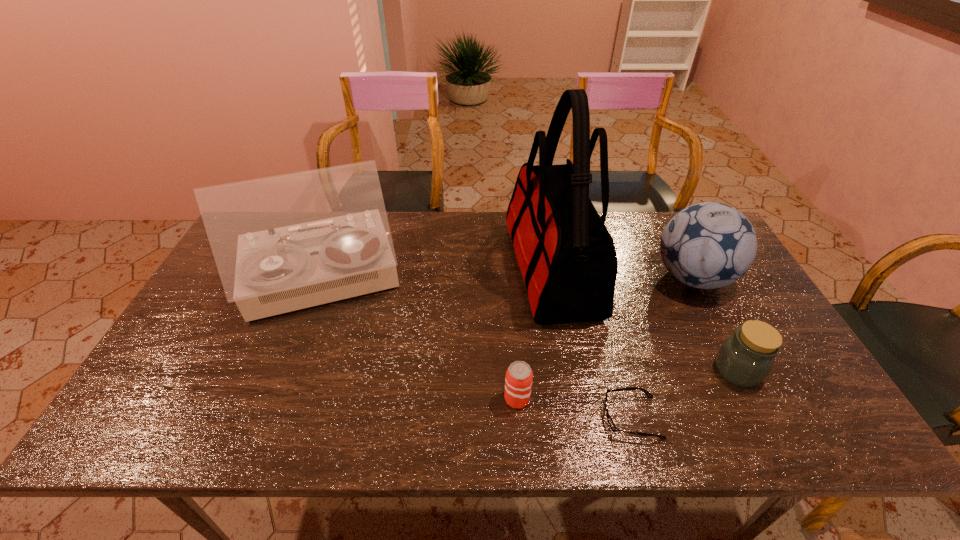
This screenshot has height=540, width=960. Find the location of `beer can present at the near edge`. beer can present at the near edge is located at coordinates (518, 382).

The image size is (960, 540). I want to click on spectacles present at the near edge, so click(609, 419).

Find the location of a particular element. This screenshot has width=960, height=540. object located in the left edge section of the desktop is located at coordinates (282, 243).

Find the location of a particular element. soccer ball that is at the right edge is located at coordinates (709, 245).

Image resolution: width=960 pixels, height=540 pixels. Find the location of `jar located at the right edge`. jar located at the right edge is located at coordinates (745, 359).

Find the location of a particular element. The image size is (960, 540). object located in the far left corner section of the desktop is located at coordinates (282, 243).

Locate an element on the screen. object that is positioned at the far right corner is located at coordinates (709, 245).

You are a GUI agent. You are given a task and a screenshot of the screen. Output one action in this format:
    pyautogui.click(x=<x>, y=<y>)
    Task: Click on the free region at the far edge
    The height and width of the screenshot is (540, 960).
    Given the screenshot: What is the action you would take?
    pyautogui.click(x=421, y=233)

Where is `vacant region at the near edge`? The width and height of the screenshot is (960, 540). vacant region at the near edge is located at coordinates (457, 424).

What are the coordinates of `free spot at the right edge of the desktop` in the screenshot? It's located at (x=725, y=340).